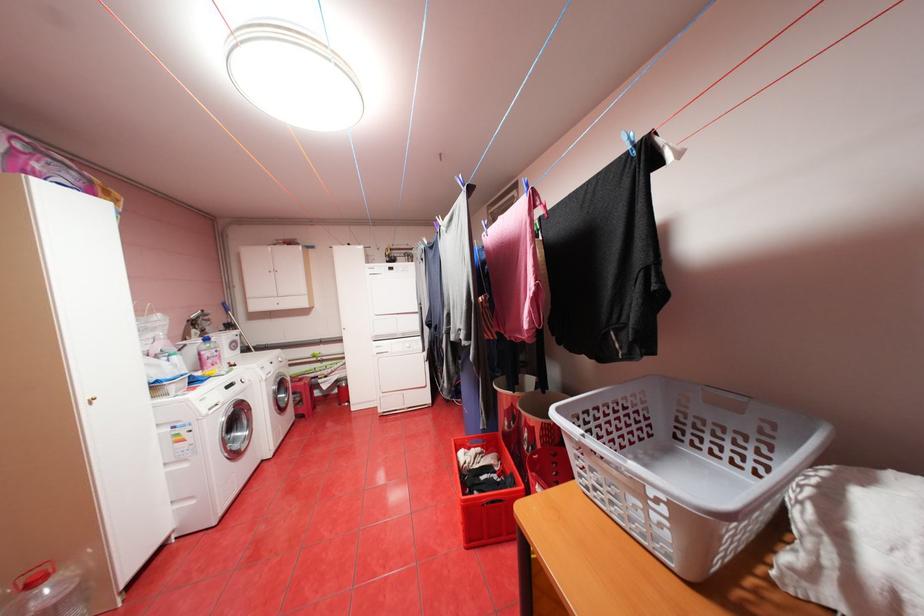
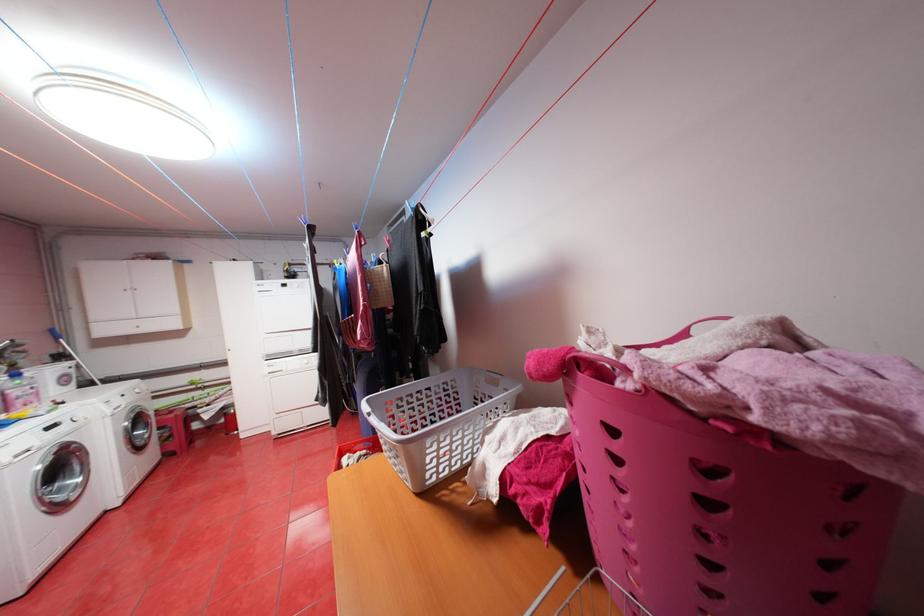
The images are taken continuously from a first-person perspective. In which direction are you moving?

The cameraman moved toward right, backward.